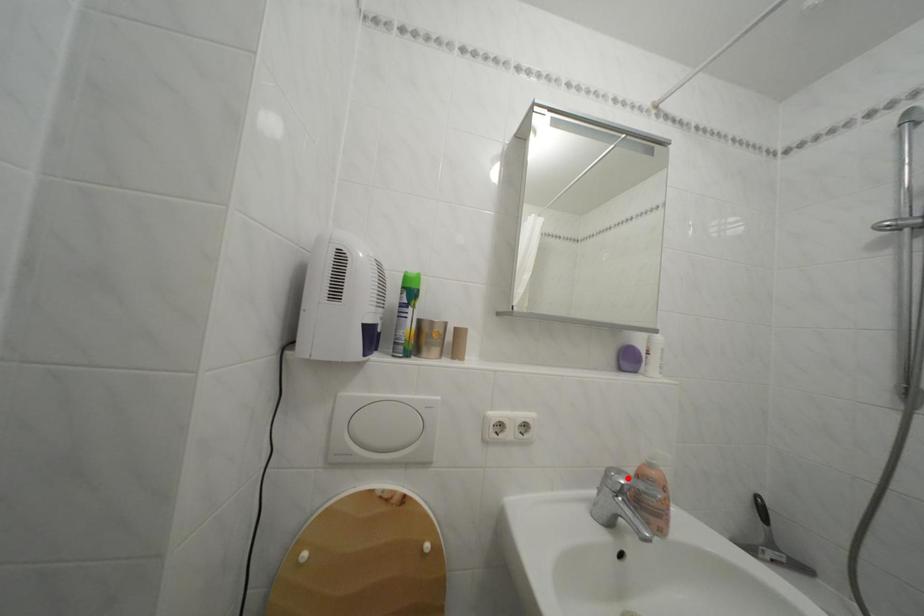
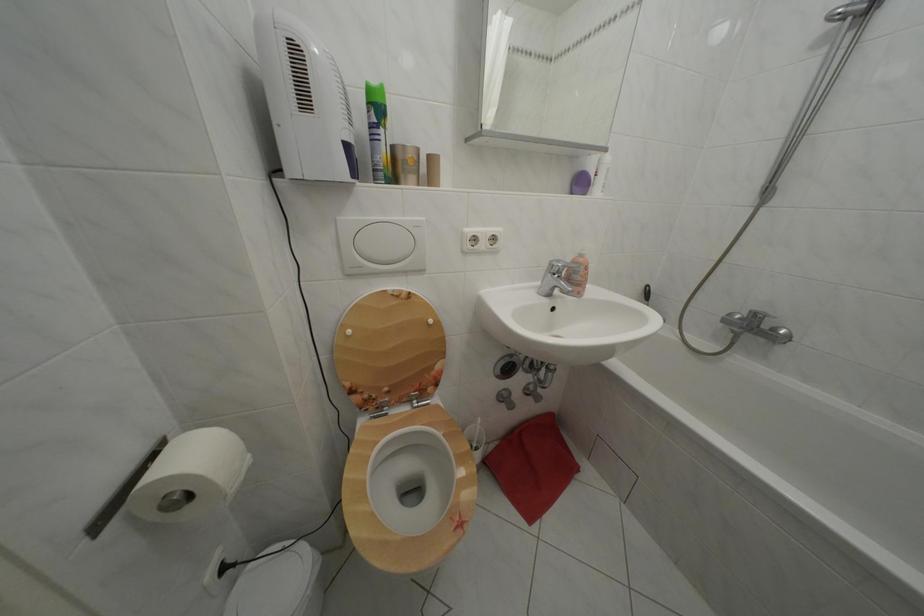
In the second image, find the point that corresponds to the highlighted location in the first image.

(567, 268)